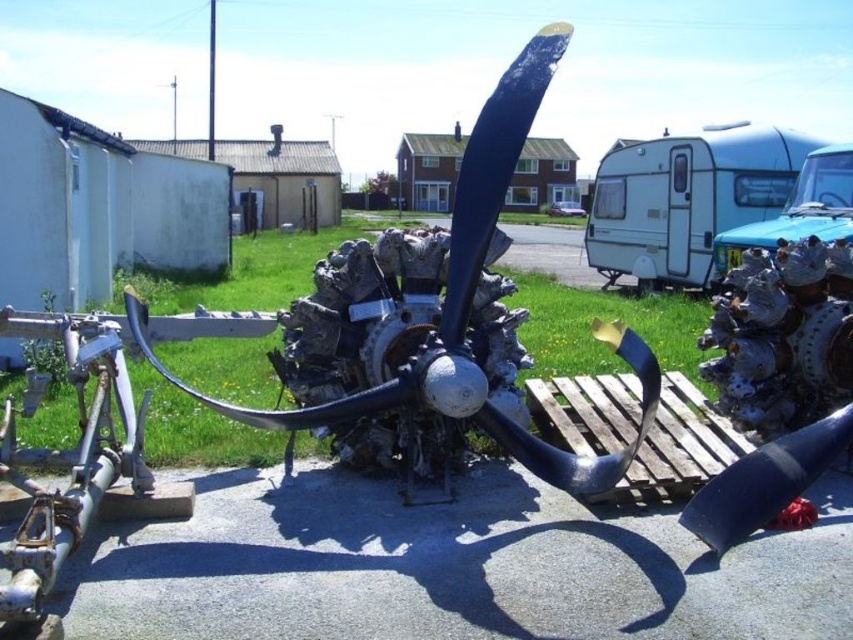
You are a delivery driver who needs to transport both the blue metallic propeller at center and the blue metallic trailer at right. The trailer has a height restriction of 2 meters. Can you safely load the propeller onto the trailer without exceeding the height limit?

The blue metallic propeller at center is much taller than the blue metallic trailer at right. Since the trailer has a height restriction of 2 meters, the propeller likely exceeds this limit, making it unsafe to load it onto the trailer without violating the height restriction.

You are a buyer looking to transport the blue metallic propeller at center and the light blue plastic trailer at upper right. Which object should be loaded first onto the truck if the trailer needs to be placed closer to the truck cab for stability?

The light blue plastic trailer at upper right should be loaded first because it needs to be placed closer to the truck cab for stability, so the blue metallic propeller at center can be positioned behind it.

You are a delivery driver who needs to park your truck between the light blue plastic trailer at upper right and the blue metallic trailer at right. The truck requires 10 feet of space to park. Based on the scene, can you fit your truck between them?

The light blue plastic trailer at upper right is 8.23 feet away from the blue metallic trailer at right. Since the truck requires 10 feet of space to park, the distance between them is insufficient. You cannot fit your truck between them.